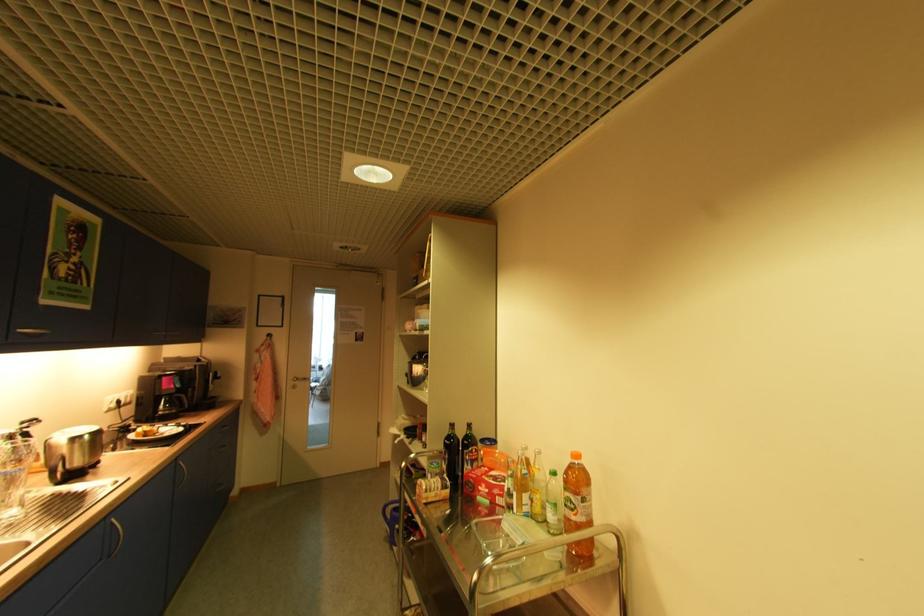
What do you see at coordinates (116, 535) in the screenshot? I see `the blue cabinet handle` at bounding box center [116, 535].